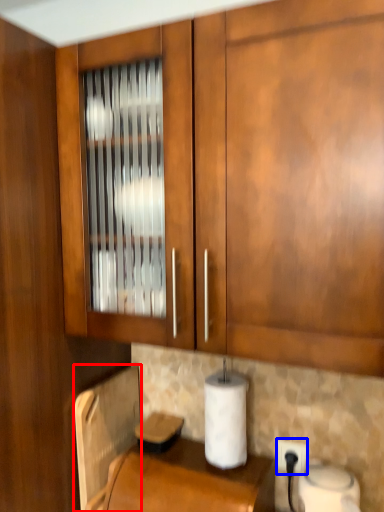
Question: Among these objects, which one is nearest to the camera, appliance (highlighted by a red box) or electric outlet (highlighted by a blue box)?

Choices:
 (A) appliance
 (B) electric outlet

Answer: (A)